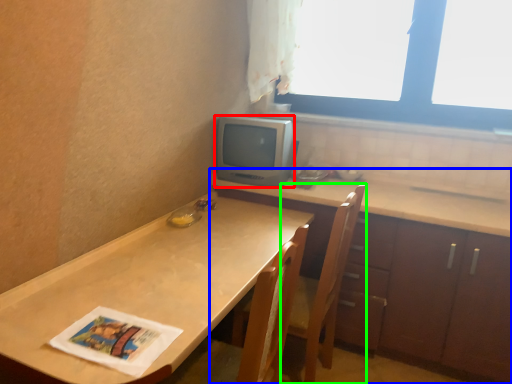
Question: Which object is positioned farthest from appliance (highlighted by a red box)? Select from cabinetry (highlighted by a blue box) and chair (highlighted by a green box).

Choices:
 (A) cabinetry
 (B) chair

Answer: (B)